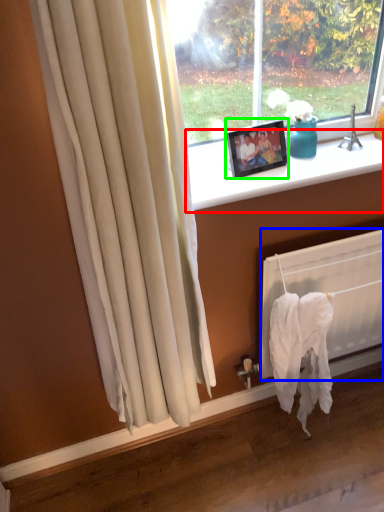
Question: Based on their relative distances, which object is farther from window sill (highlighted by a red box)? Choose from radiator (highlighted by a blue box) and picture frame (highlighted by a green box).

Choices:
 (A) radiator
 (B) picture frame

Answer: (A)